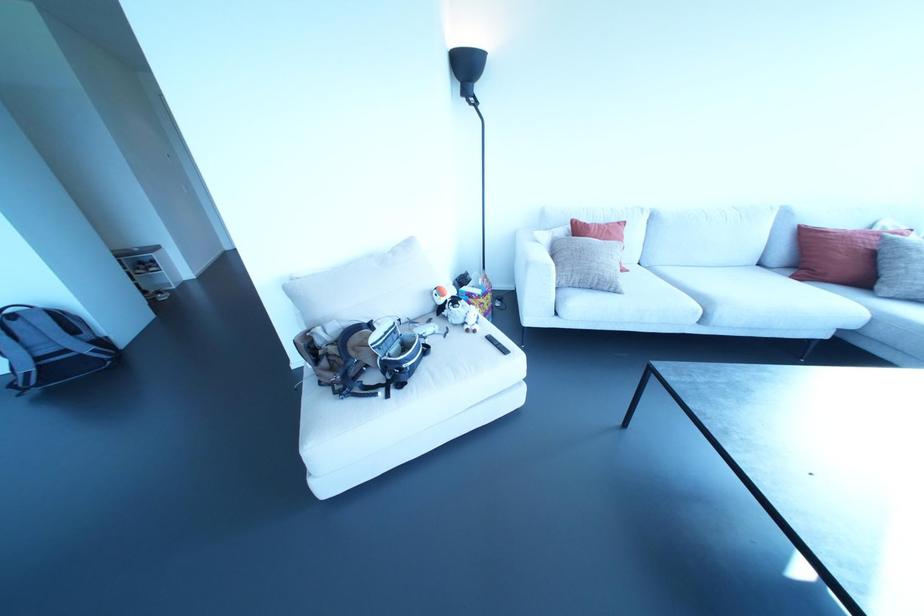
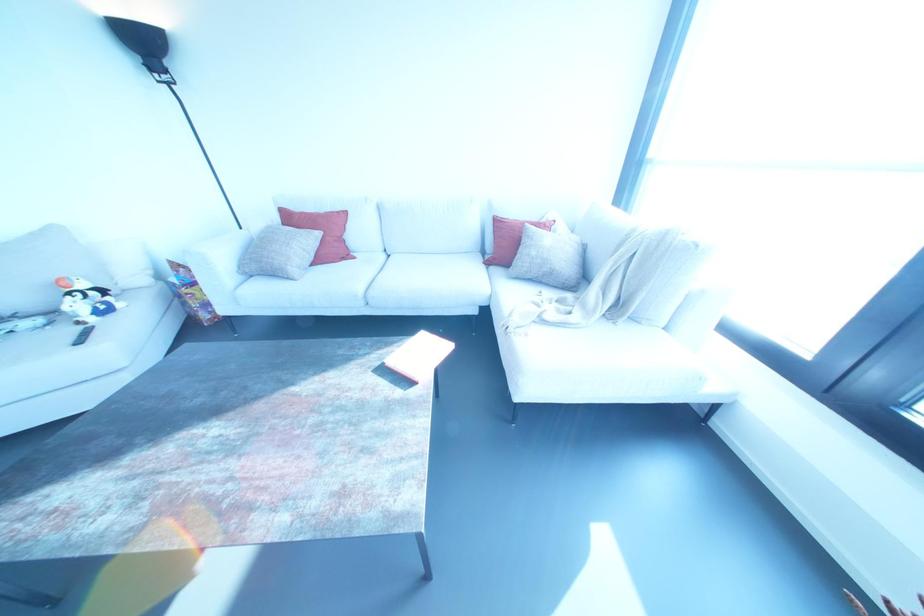
Locate, in the second image, the point that corresponds to (x=577, y=228) in the first image.

(286, 217)